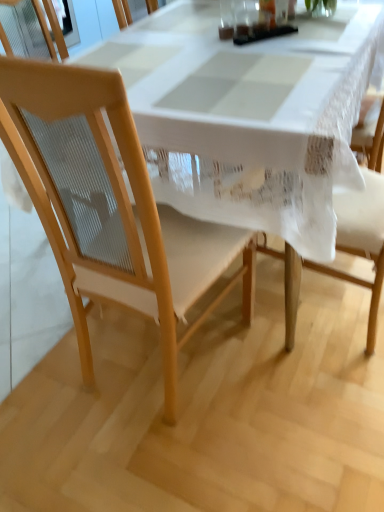
Identify the location of vacant space to the left of light wood chair at center. (48, 361).